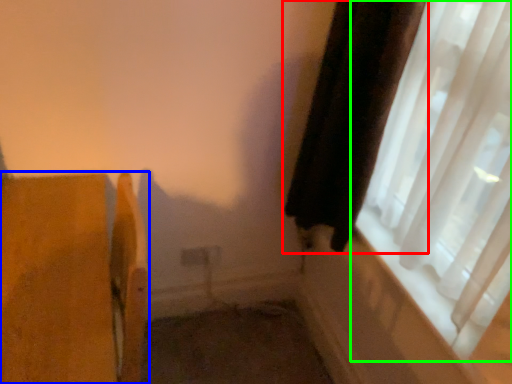
Question: Based on their relative distances, which object is nearer to curtain (highlighted by a red box)? Choose from furniture (highlighted by a blue box) and window (highlighted by a green box).

Choices:
 (A) furniture
 (B) window

Answer: (B)